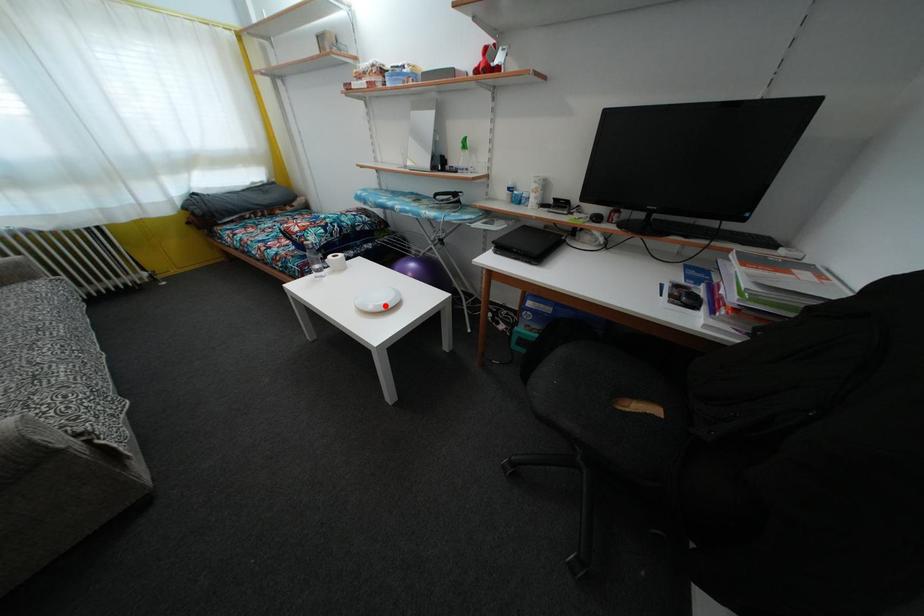
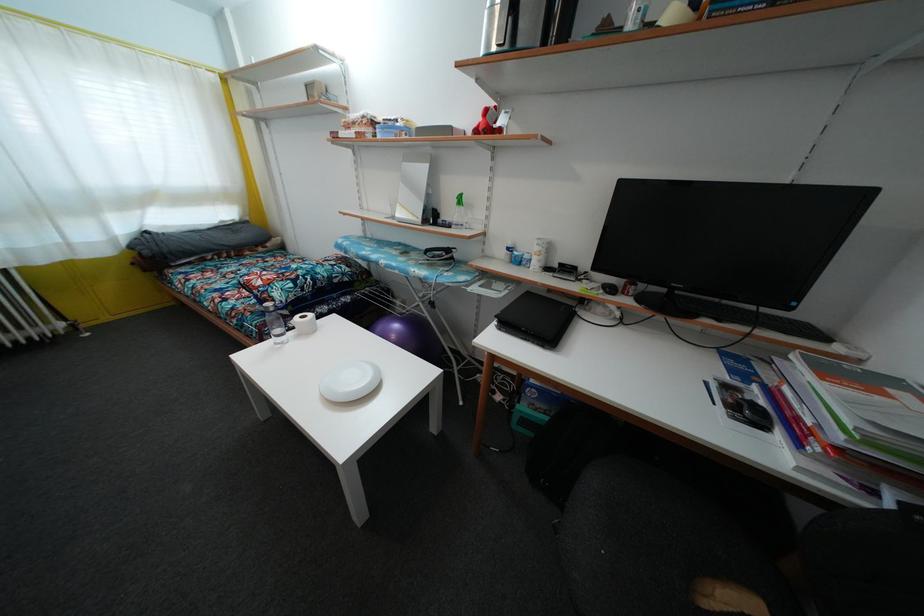
Locate, in the second image, the point that corresponds to the highlighted location in the first image.

(359, 387)